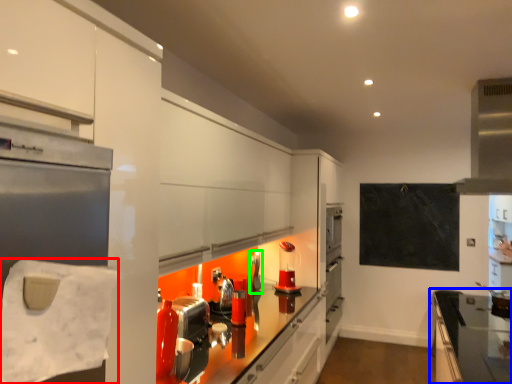
Question: Based on their relative distances, which object is nearer to toilet paper (highlighted by a red box)? Choose from countertop (highlighted by a blue box) and appliance (highlighted by a green box).

Choices:
 (A) countertop
 (B) appliance

Answer: (B)